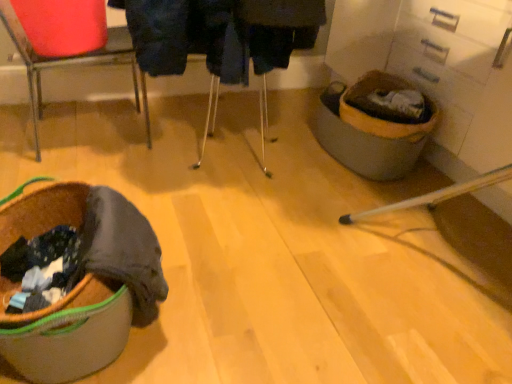
Find the location of a particular element. This screenshot has height=384, width=512. vacant space behind metallic red chair at upper left is located at coordinates (124, 102).